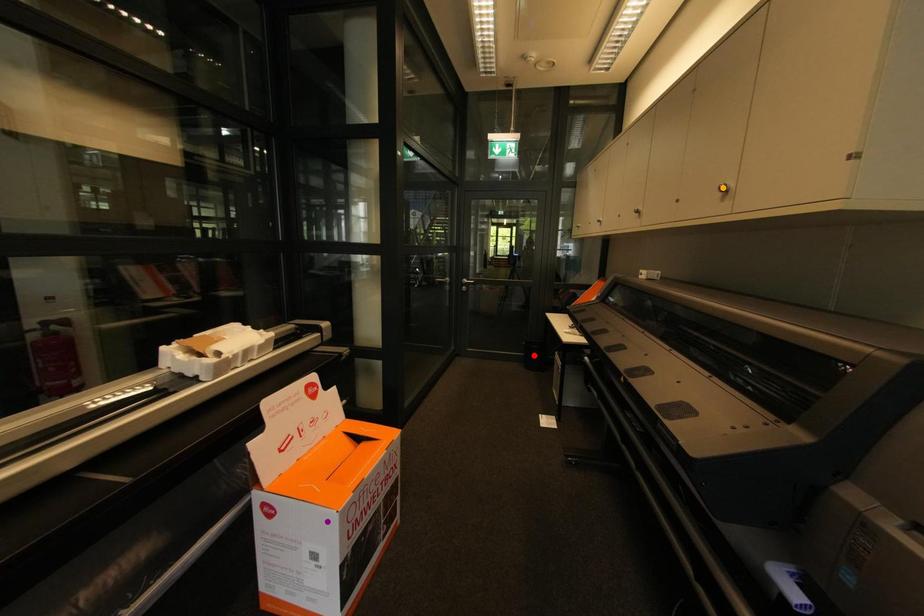
Order these from nearest to farthest:
A) orange point
B) red point
C) purple point

1. orange point
2. purple point
3. red point